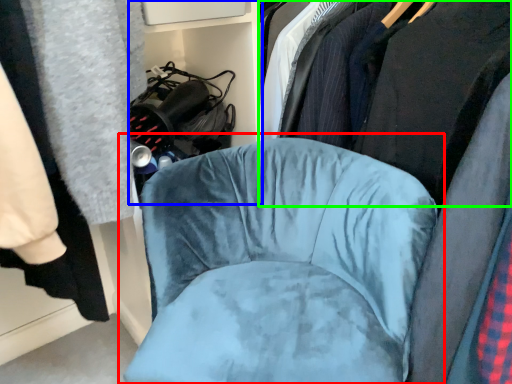
Question: Which object is positioned closest to chair (highlighted by a red box)? Select from bookshelf (highlighted by a blue box) and clothing (highlighted by a green box).

Choices:
 (A) bookshelf
 (B) clothing

Answer: (B)